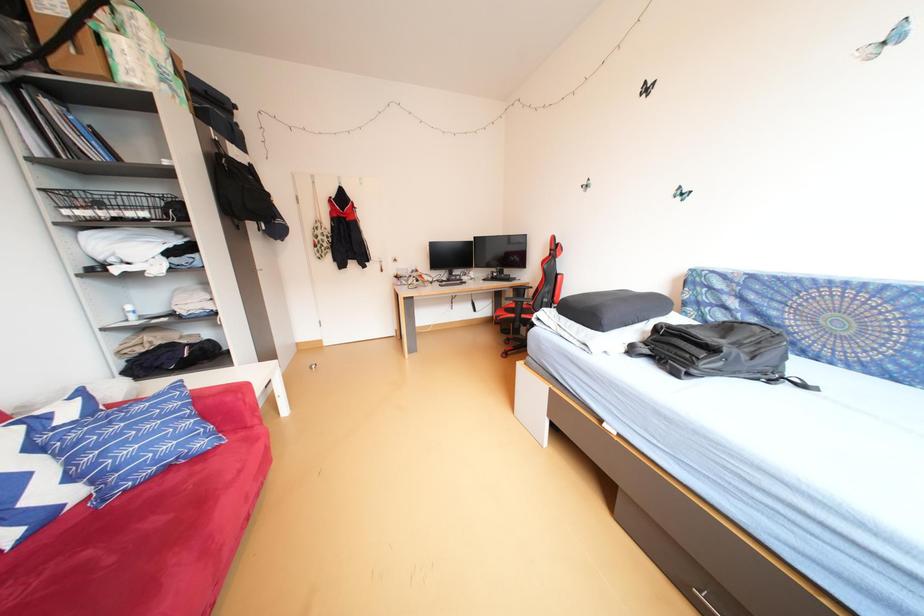
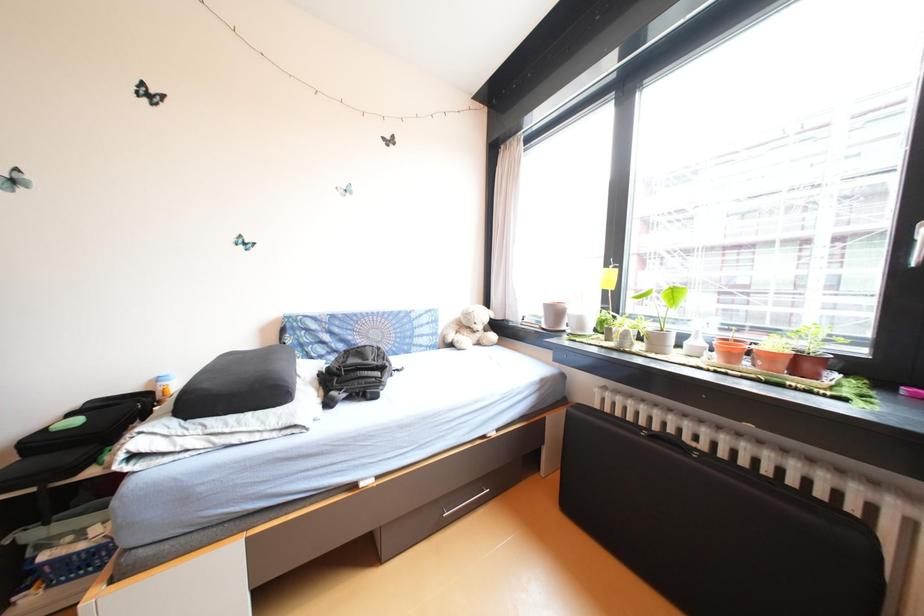
Question: The camera is either moving clockwise (left) or counter-clockwise (right) around the object. The first image is from the beginning of the video and the second image is from the end. Is the camera moving left or right when shooting the video?

Choices:
 (A) Left
 (B) Right

Answer: (A)